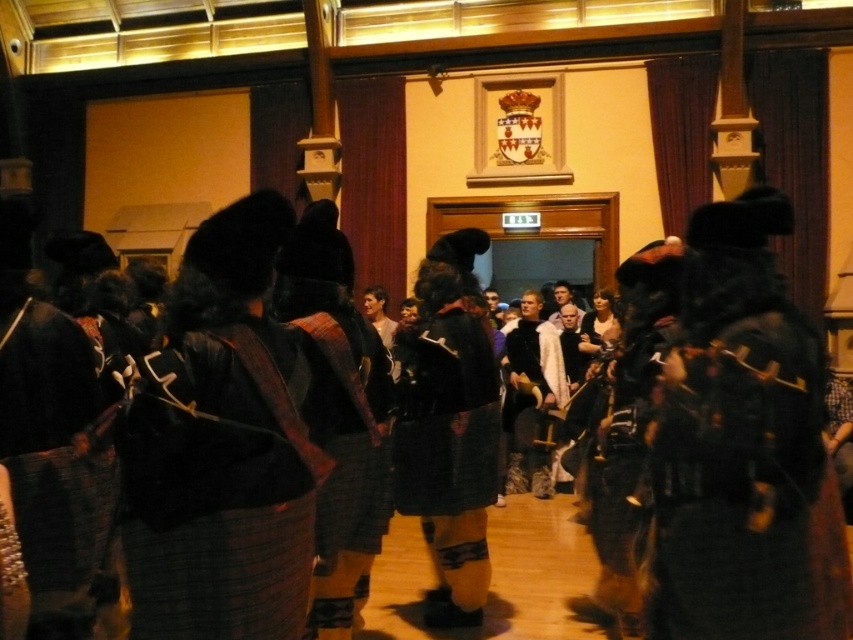
Question: Does plaid wool kilt at center have a lesser width compared to black woolen kilt at center?

Choices:
 (A) yes
 (B) no

Answer: (B)

Question: Estimate the real-world distances between objects in this image. Which object is closer to the plaid wool kilt at center?

Choices:
 (A) velvet black kilt at right
 (B) black woolen kilt at center

Answer: (B)

Question: Which point is closer to the camera?

Choices:
 (A) (401, 429)
 (B) (682, 360)

Answer: (B)

Question: From the image, what is the correct spatial relationship of velvet black kilt at right in relation to plaid wool kilt at center?

Choices:
 (A) above
 (B) below

Answer: (A)

Question: Does velvet black kilt at right have a greater width compared to plaid wool kilt at center?

Choices:
 (A) no
 (B) yes

Answer: (B)

Question: Which of the following is the farthest from the observer?

Choices:
 (A) (466, 595)
 (B) (161, 458)

Answer: (A)